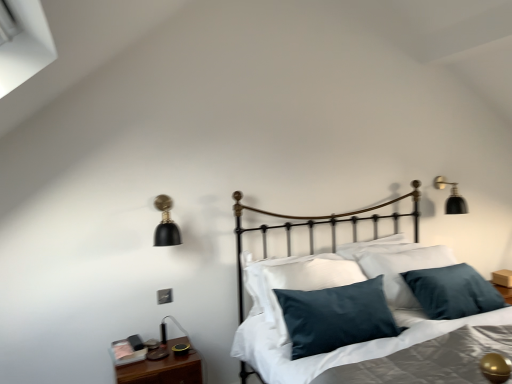
Question: Is velvety dark blue pillow at center, which appears as the first pillow when viewed from the back, a part of silky gray sheet at center?

Choices:
 (A) no
 (B) yes

Answer: (A)

Question: Is silky gray sheet at center to the left of velvety dark blue pillow at center, which appears as the first pillow when viewed from the back, from the viewer's perspective?

Choices:
 (A) no
 (B) yes

Answer: (A)

Question: Can you see silky gray sheet at center touching velvety dark blue pillow at center, which appears as the first pillow when viewed from the back?

Choices:
 (A) no
 (B) yes

Answer: (A)

Question: Considering the relative sizes of silky gray sheet at center and velvety dark blue pillow at center, which appears as the first pillow when viewed from the back, in the image provided, is silky gray sheet at center bigger than velvety dark blue pillow at center, which appears as the first pillow when viewed from the back,?

Choices:
 (A) yes
 (B) no

Answer: (A)

Question: Considering the relative sizes of silky gray sheet at center and velvety dark blue pillow at center, which ranks as the second pillow in front-to-back order, in the image provided, is silky gray sheet at center wider than velvety dark blue pillow at center, which ranks as the second pillow in front-to-back order,?

Choices:
 (A) no
 (B) yes

Answer: (B)

Question: Is silky gray sheet at center taller than velvety dark blue pillow at center, which ranks as the second pillow in front-to-back order?

Choices:
 (A) no
 (B) yes

Answer: (A)

Question: Is black matte wall sconce at upper right, which is counted as the 2th lamp, starting from the front, looking in the opposite direction of silky gray sheet at center?

Choices:
 (A) yes
 (B) no

Answer: (B)

Question: From a real-world perspective, is black matte wall sconce at upper right, acting as the first lamp starting from the right, beneath silky gray sheet at center?

Choices:
 (A) yes
 (B) no

Answer: (B)

Question: Is black matte wall sconce at upper right, which ranks as the 1th lamp in back-to-front order, not close to silky gray sheet at center?

Choices:
 (A) no
 (B) yes

Answer: (B)

Question: From the image's perspective, does black matte wall sconce at upper right, acting as the first lamp starting from the right, appear lower than silky gray sheet at center?

Choices:
 (A) no
 (B) yes

Answer: (A)

Question: Can you confirm if black matte wall sconce at upper right, which ranks as the 1th lamp in back-to-front order, is positioned to the right of silky gray sheet at center?

Choices:
 (A) yes
 (B) no

Answer: (A)

Question: Is black matte wall sconce at upper right, acting as the first lamp starting from the right, positioned in front of silky gray sheet at center?

Choices:
 (A) yes
 (B) no

Answer: (B)

Question: Is wooden nightstand at lower left turned away from velvety dark blue pillow at center, which appears as the first pillow when viewed from the back?

Choices:
 (A) no
 (B) yes

Answer: (A)